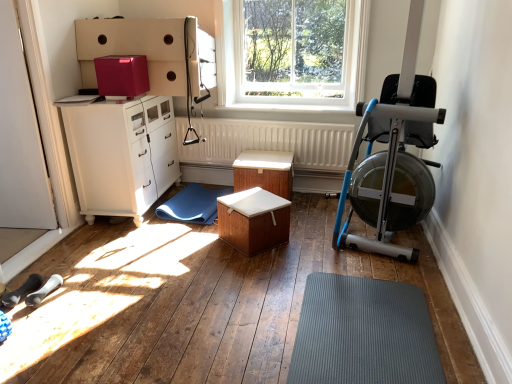
Where is `free point above wooden table at center, the 2th table positioned from the front (from a real-world perspective)`? free point above wooden table at center, the 2th table positioned from the front (from a real-world perspective) is located at coordinates (263, 158).